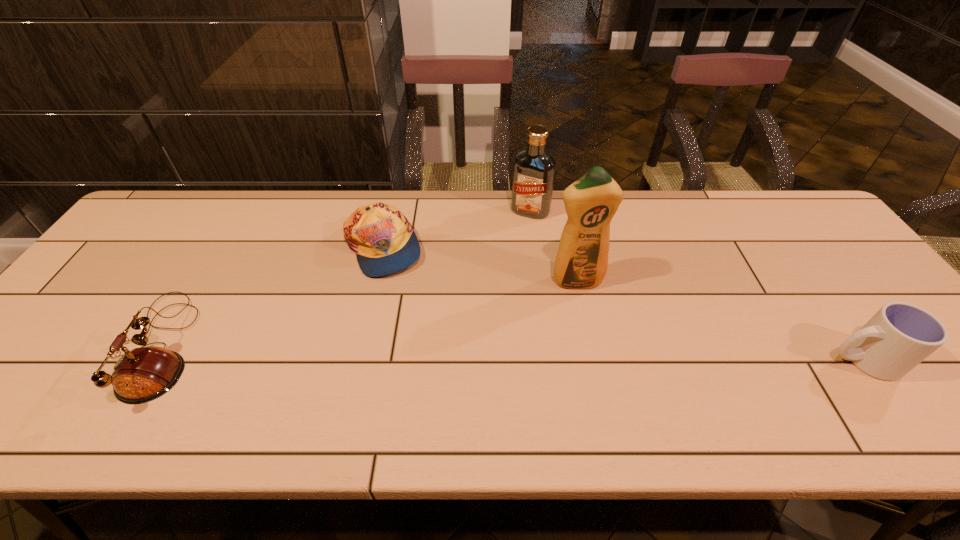
Find the location of a particular element. This screenshot has width=960, height=540. vodka that is at the far edge is located at coordinates (534, 169).

Image resolution: width=960 pixels, height=540 pixels. Find the location of `cap at the far edge`. cap at the far edge is located at coordinates (384, 241).

Find the location of a particular element. The image size is (960, 540). telephone at the near edge is located at coordinates (141, 375).

Find the location of a particular element. cup present at the near edge is located at coordinates (900, 335).

The image size is (960, 540). Identify the location of object at the right edge. (900, 335).

Locate an element on the screen. object situated at the near right corner is located at coordinates (900, 335).

Find the location of a particular element. The width and height of the screenshot is (960, 540). vacant region at the far edge of the desktop is located at coordinates (414, 227).

This screenshot has height=540, width=960. I want to click on free space at the near edge of the desktop, so click(x=366, y=386).

The height and width of the screenshot is (540, 960). Identify the location of free space at the far right corner. (780, 213).

Where is `vacant point located between the fourth object from right to left and the cup`? Image resolution: width=960 pixels, height=540 pixels. vacant point located between the fourth object from right to left and the cup is located at coordinates (622, 303).